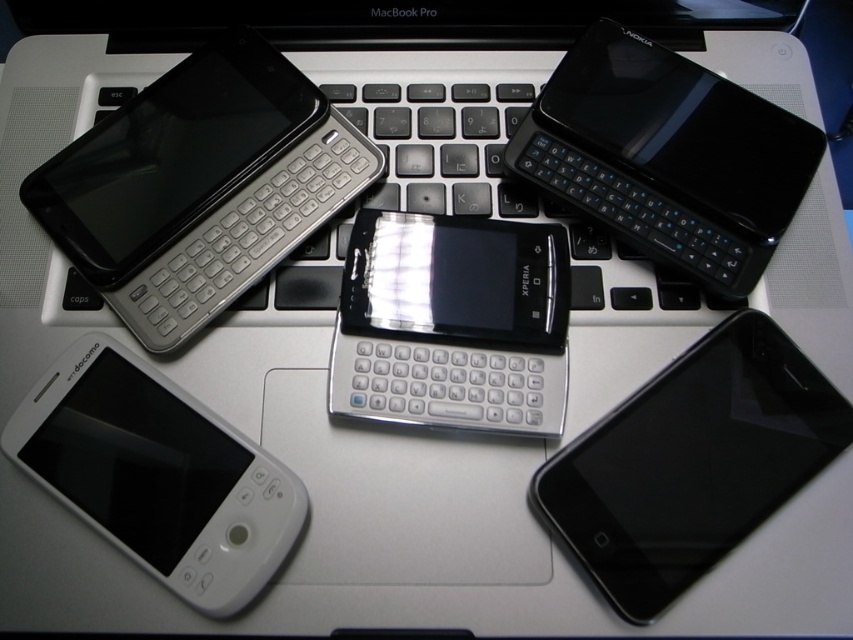
Question: Estimate the real-world distances between objects in this image. Which object is farther from the matte silver phone at upper left?

Choices:
 (A) white matte phone at lower left
 (B) black glossy nokia phone at upper right

Answer: (B)

Question: Observing the image, what is the correct spatial positioning of silver metallic keyboard at center in reference to black glossy smartphone at bottom right?

Choices:
 (A) below
 (B) above

Answer: (B)

Question: Does black glossy smartphone at bottom right appear over black glossy nokia phone at upper right?

Choices:
 (A) no
 (B) yes

Answer: (A)

Question: Among these objects, which one is farthest from the camera?

Choices:
 (A) black glossy nokia phone at upper right
 (B) black glossy smartphone at bottom right
 (C) matte silver phone at upper left
 (D) white matte phone at lower left

Answer: (C)

Question: Which point is closer to the camera?

Choices:
 (A) (128, 396)
 (B) (666, 262)

Answer: (A)

Question: Does silver metallic keyboard at center have a smaller size compared to white matte phone at lower left?

Choices:
 (A) no
 (B) yes

Answer: (A)